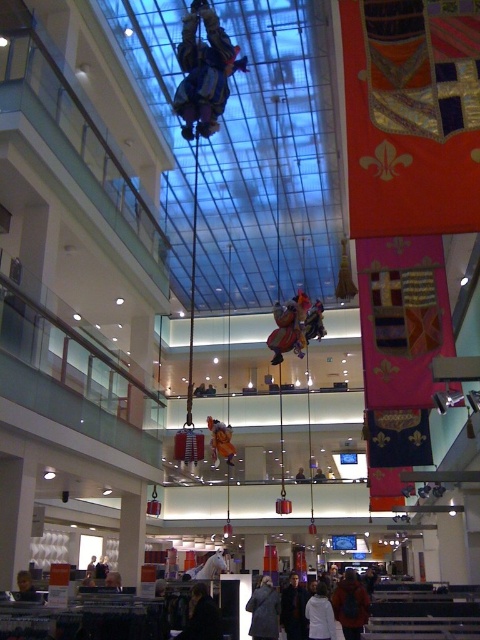
Who is positioned more to the left, dark gray jacket at center or smooth skin face at lower left?

smooth skin face at lower left is more to the left.

Does dark gray jacket at center lie in front of smooth skin face at lower left?

No.

Where is `dark gray jacket at center`? dark gray jacket at center is located at coordinates (294, 609).

Find the location of `reflective silver helmet at center`. reflective silver helmet at center is located at coordinates (204, 72).

Can you confirm if reflective silver helmet at center is wider than white matte coat at lower center?

Yes.

Image resolution: width=480 pixels, height=640 pixels. Find the location of `reflective silver helmet at center`. reflective silver helmet at center is located at coordinates (204, 72).

Locate an element on the screen. reflective silver helmet at center is located at coordinates (204, 72).

Find the location of a particular element. dark gray jacket at center is located at coordinates (294, 609).

At what (x,y) coordinates should I click in order to perform the action: click on dark gray jacket at center. Please return your answer as a coordinate pair (x, y). Looking at the image, I should click on (294, 609).